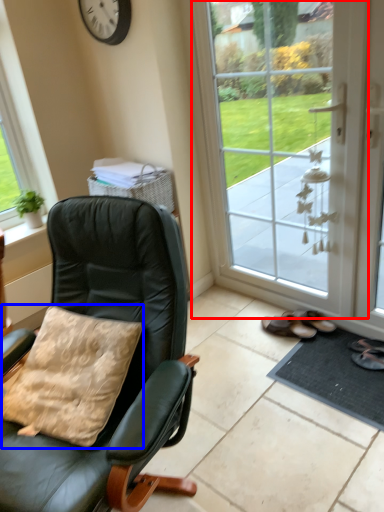
Question: Which point is further to the camera, door (highlighted by a red box) or pillow (highlighted by a blue box)?

Choices:
 (A) door
 (B) pillow

Answer: (A)